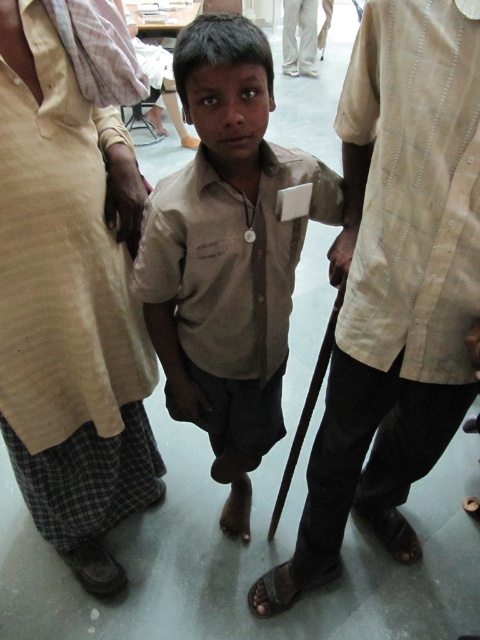
Question: Estimate the real-world distances between objects in this image. Which object is farther from the beige textured shirt at center?

Choices:
 (A) beige cotton shirt at left
 (B) white fabric pants at upper center

Answer: (B)

Question: Can you confirm if beige cotton shirt at left is positioned below matte khaki shirt at center?

Choices:
 (A) yes
 (B) no

Answer: (B)

Question: Which object appears closest to the camera in this image?

Choices:
 (A) beige cotton shirt at left
 (B) beige textured shirt at center
 (C) white fabric pants at upper center
 (D) matte khaki shirt at center

Answer: (B)

Question: Is the position of beige textured shirt at center more distant than that of white fabric pants at upper center?

Choices:
 (A) yes
 (B) no

Answer: (B)

Question: Estimate the real-world distances between objects in this image. Which object is farther from the matte khaki shirt at center?

Choices:
 (A) beige textured shirt at center
 (B) white fabric pants at upper center

Answer: (B)

Question: Does beige textured shirt at center appear on the right side of white fabric pants at upper center?

Choices:
 (A) no
 (B) yes

Answer: (A)